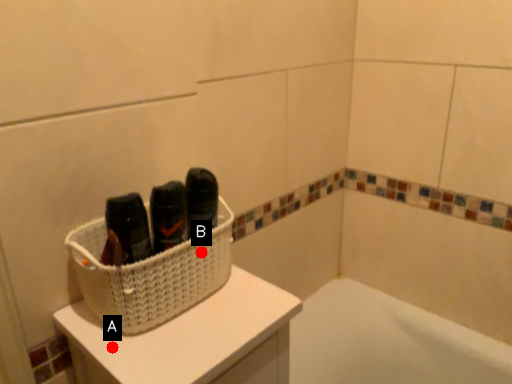
Question: Two points are circled on the image, labeled by A and B beside each circle. Which point appears closest to the camera in this image?

Choices:
 (A) A is closer
 (B) B is closer

Answer: (A)